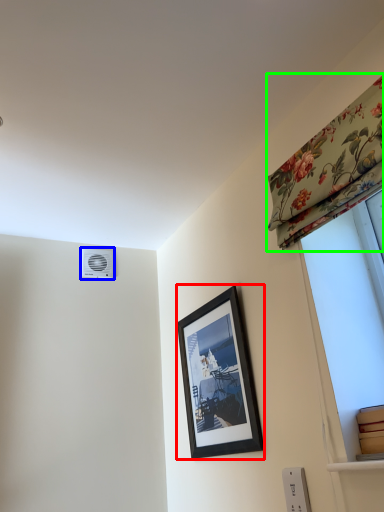
Question: Based on their relative distances, which object is farther from picture frame (highlighted by a red box)? Choose from air conditioning (highlighted by a blue box) and curtain (highlighted by a green box).

Choices:
 (A) air conditioning
 (B) curtain

Answer: (A)